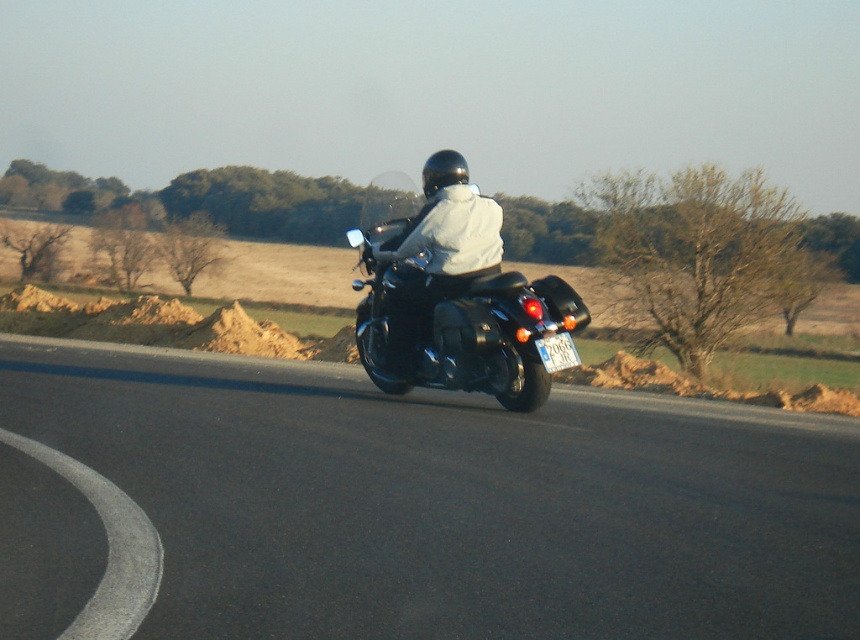
Can you confirm if black asphalt road at center is thinner than matte black motorcycle at center?

Incorrect, black asphalt road at center's width is not less than matte black motorcycle at center's.

Where is `black asphalt road at center`? black asphalt road at center is located at coordinates (453, 502).

The image size is (860, 640). Find the location of `black asphalt road at center`. black asphalt road at center is located at coordinates (453, 502).

Can you confirm if black matte motorcycle at center is positioned to the right of black asphalt curve at lower left?

Yes, black matte motorcycle at center is to the right of black asphalt curve at lower left.

Is black matte motorcycle at center below black asphalt curve at lower left?

No, black matte motorcycle at center is not below black asphalt curve at lower left.

Which is in front, point (531, 336) or point (139, 508)?

Point (139, 508) is in front.

The image size is (860, 640). I want to click on black matte motorcycle at center, so [455, 300].

Between black matte motorcycle at center and matte black motorcycle at center, which one is positioned lower?

matte black motorcycle at center is below.

Is point (387, 385) in front of point (433, 257)?

No, it is behind (433, 257).

I want to click on black matte motorcycle at center, so click(x=455, y=300).